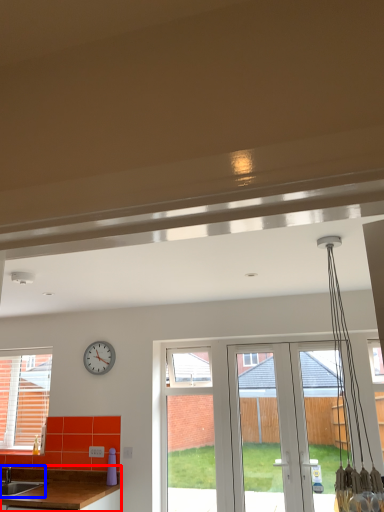
Question: Which of the following is the closest to the observer, countertop (highlighted by a red box) or sink (highlighted by a blue box)?

Choices:
 (A) countertop
 (B) sink

Answer: (A)